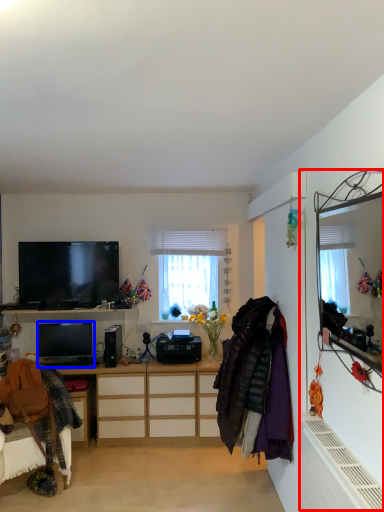
Question: Which point is further to the camera, side (highlighted by a red box) or desktop computer (highlighted by a blue box)?

Choices:
 (A) side
 (B) desktop computer

Answer: (B)